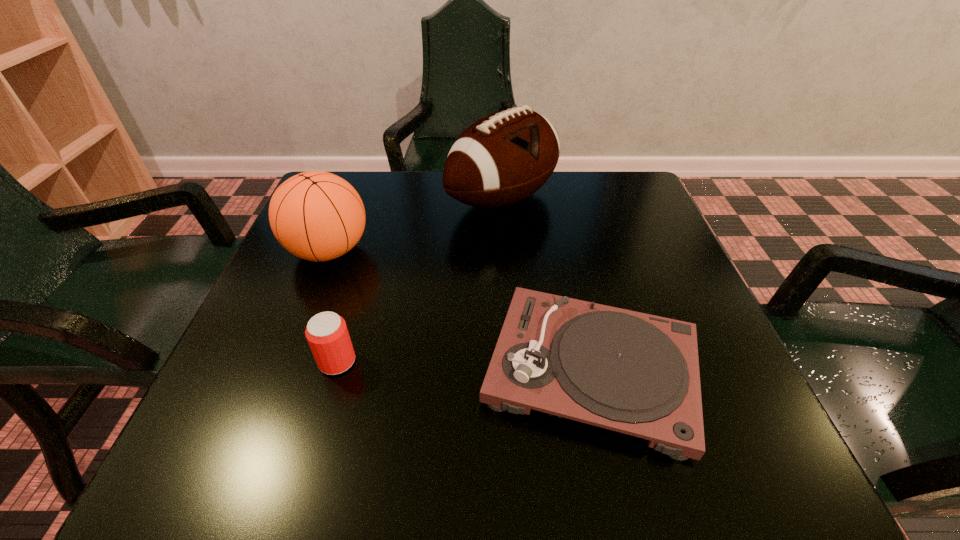
The width and height of the screenshot is (960, 540). Identify the location of object situated at the near edge. (630, 372).

This screenshot has height=540, width=960. What are the coordinates of `basketball that is positioned at the left edge` in the screenshot? It's located at (318, 216).

This screenshot has height=540, width=960. What are the coordinates of `beer can at the left edge` in the screenshot? It's located at pos(327,334).

Image resolution: width=960 pixels, height=540 pixels. What are the coordinates of `object that is at the right edge` in the screenshot? It's located at (630, 372).

Where is `object situated at the far left corner`? object situated at the far left corner is located at coordinates (318, 216).

You are a GUI agent. You are given a task and a screenshot of the screen. Output one action in this format:
    pyautogui.click(x=<x>, y=<y>)
    Task: Click on the object that is at the near right corner
    The height and width of the screenshot is (540, 960).
    Given the screenshot: What is the action you would take?
    pyautogui.click(x=630, y=372)

This screenshot has height=540, width=960. In the image, there is a desktop. Find the location of `vacant region at the far edge`. vacant region at the far edge is located at coordinates (381, 199).

Find the location of a particular element. free space at the left edge of the desktop is located at coordinates (322, 263).

Where is `free spot at the far left corner of the desktop`? This screenshot has height=540, width=960. free spot at the far left corner of the desktop is located at coordinates [372, 176].

I want to click on free space at the far right corner, so click(621, 206).